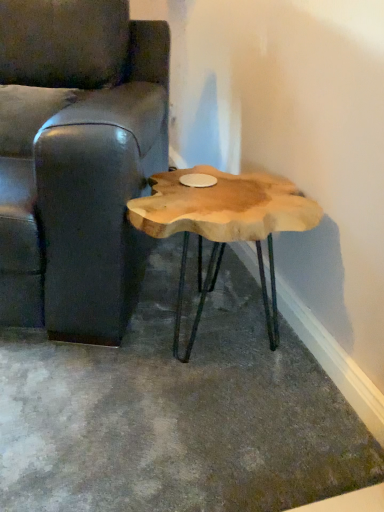
Question: Considering their positions, is leather couch at left located in front of or behind natural wood coffee table at center?

Choices:
 (A) front
 (B) behind

Answer: (A)

Question: Considering the positions of leather couch at left and natural wood coffee table at center in the image, is leather couch at left wider or thinner than natural wood coffee table at center?

Choices:
 (A) wide
 (B) thin

Answer: (A)

Question: Considering the positions of leather couch at left and natural wood coffee table at center in the image, is leather couch at left bigger or smaller than natural wood coffee table at center?

Choices:
 (A) big
 (B) small

Answer: (A)

Question: From the image's perspective, is natural wood coffee table at center above or below leather couch at left?

Choices:
 (A) below
 (B) above

Answer: (A)

Question: In terms of width, does natural wood coffee table at center look wider or thinner when compared to leather couch at left?

Choices:
 (A) thin
 (B) wide

Answer: (A)

Question: Based on their sizes in the image, would you say natural wood coffee table at center is bigger or smaller than leather couch at left?

Choices:
 (A) small
 (B) big

Answer: (A)

Question: Is point (203, 193) closer or farther from the camera than point (61, 176)?

Choices:
 (A) closer
 (B) farther

Answer: (B)